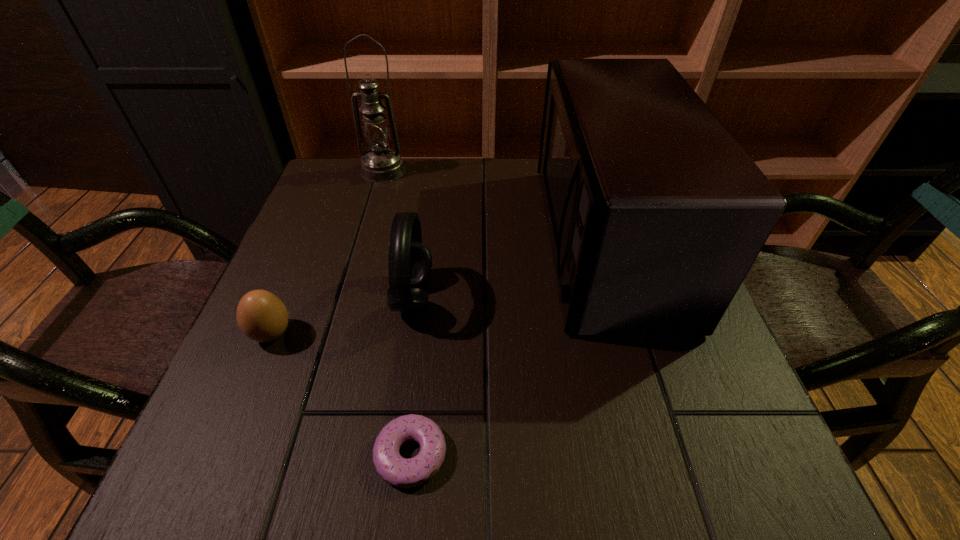
In order to click on object located at the far left corner in this screenshot , I will do `click(381, 164)`.

At what (x,y) coordinates should I click in order to perform the action: click on object located at the far right corner. Please return your answer as a coordinate pair (x, y). Looking at the image, I should click on (656, 214).

At what (x,y) coordinates should I click in order to perform the action: click on vacant space at the far edge of the desktop. Please return your answer as a coordinate pair (x, y). The width and height of the screenshot is (960, 540). Looking at the image, I should click on (511, 181).

Locate an element on the screen. The image size is (960, 540). vacant space at the near edge of the desktop is located at coordinates (547, 488).

Locate an element on the screen. The height and width of the screenshot is (540, 960). free space at the left edge of the desktop is located at coordinates (284, 347).

What are the coordinates of `vacant region at the far left corner` in the screenshot? It's located at (327, 167).

Identify the location of vacant point at the near left corner. (254, 492).

Where is `empty location between the fourth object from right to left and the leftmost object`? The height and width of the screenshot is (540, 960). empty location between the fourth object from right to left and the leftmost object is located at coordinates pyautogui.click(x=327, y=252).

Where is `free space between the doughnut and the third shortest object`? Image resolution: width=960 pixels, height=540 pixels. free space between the doughnut and the third shortest object is located at coordinates (412, 376).

Where is `unoccupied position between the second shortest object and the doughnut`? The height and width of the screenshot is (540, 960). unoccupied position between the second shortest object and the doughnut is located at coordinates (342, 394).